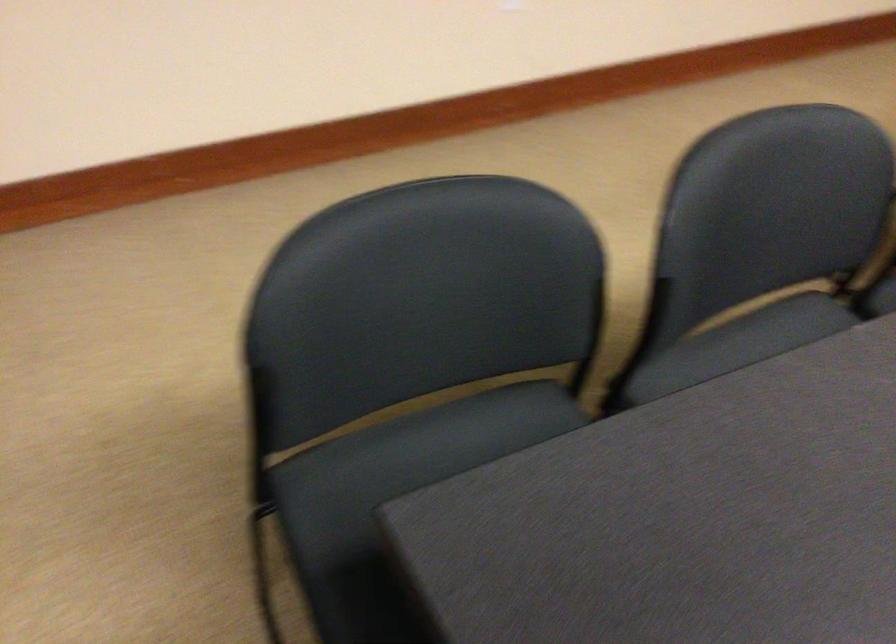
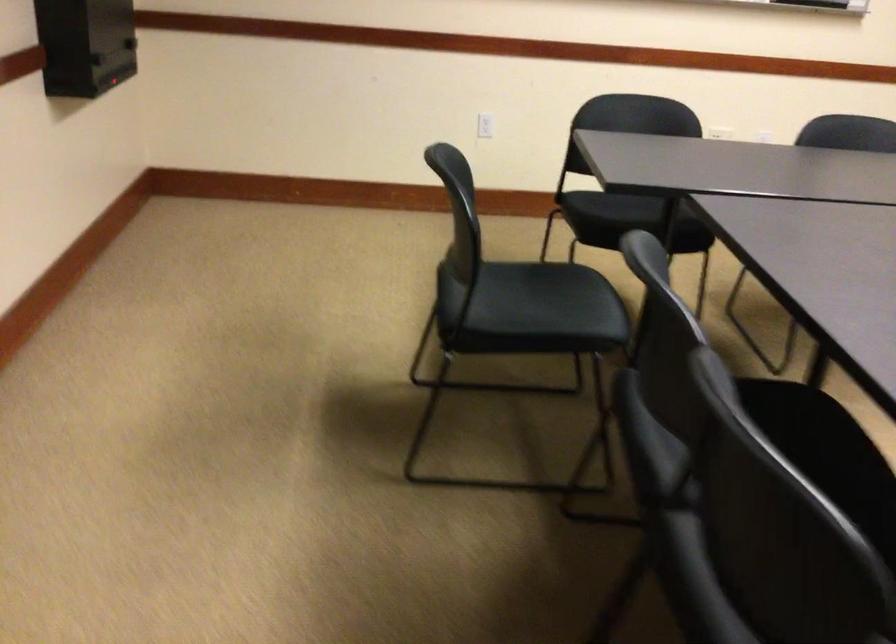
Question: In a continuous first-person perspective shot, in which direction is the camera moving?

Choices:
 (A) Left
 (B) Right
 (C) Forward
 (D) Backward

Answer: (D)